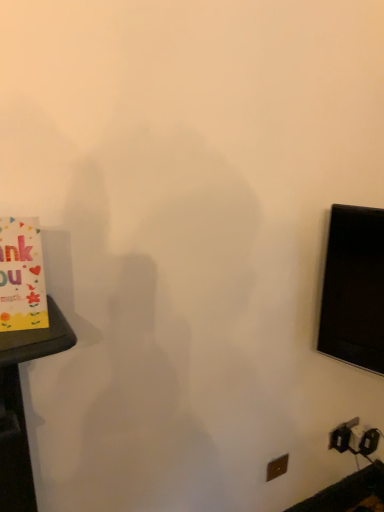
At what (x,y) coordinates should I click in order to perform the action: click on brown plastic electric outlet at lower right. Please return your answer as a coordinate pair (x, y). The height and width of the screenshot is (512, 384). Looking at the image, I should click on (277, 467).

This screenshot has height=512, width=384. Describe the element at coordinates (277, 467) in the screenshot. I see `brown plastic electric outlet at lower right` at that location.

In order to face yellow paper card at left, should I rotate leftwards or rightwards?

To align with it, rotate left about 23.982°.

Describe the element at coordinates (21, 276) in the screenshot. This screenshot has height=512, width=384. I see `yellow paper card at left` at that location.

What is the approximate height of yellow paper card at left?

7.48 inches.

The width and height of the screenshot is (384, 512). In order to click on yellow paper card at left in this screenshot , I will do `click(21, 276)`.

You are a GUI agent. You are given a task and a screenshot of the screen. Output one action in this format:
    pyautogui.click(x=<x>, y=<y>)
    Task: Click on the brown plastic electric outlet at lower right
    The image size is (384, 512).
    Given the screenshot: What is the action you would take?
    pyautogui.click(x=277, y=467)

Does brown plastic electric outlet at lower right appear on the right side of yellow paper card at left?

Yes, brown plastic electric outlet at lower right is to the right of yellow paper card at left.

Is brown plastic electric outlet at lower right positioned in front of yellow paper card at left?

No, brown plastic electric outlet at lower right is further to the viewer.

Which point is more forward, (273, 460) or (32, 316)?

The point (32, 316) is closer.

Looking at this image, from the image's perspective, is brown plastic electric outlet at lower right beneath yellow paper card at left?

Correct, brown plastic electric outlet at lower right appears lower than yellow paper card at left in the image.

From a real-world perspective, who is located higher, brown plastic electric outlet at lower right or yellow paper card at left?

yellow paper card at left is physically above.

Consider the image. Is brown plastic electric outlet at lower right wider or thinner than yellow paper card at left?

Clearly, brown plastic electric outlet at lower right has less width compared to yellow paper card at left.

Based on the photo, can you confirm if brown plastic electric outlet at lower right is shorter than yellow paper card at left?

Yes.

Considering the sizes of objects brown plastic electric outlet at lower right and yellow paper card at left in the image provided, who is bigger, brown plastic electric outlet at lower right or yellow paper card at left?

With larger size is yellow paper card at left.

Does brown plastic electric outlet at lower right contain yellow paper card at left?

No, yellow paper card at left is not surrounded by brown plastic electric outlet at lower right.

Is there a large distance between brown plastic electric outlet at lower right and yellow paper card at left?

Yes, brown plastic electric outlet at lower right and yellow paper card at left are located far from each other.

Is brown plastic electric outlet at lower right facing towards yellow paper card at left?

No.

How many degrees apart are the facing directions of brown plastic electric outlet at lower right and yellow paper card at left?

16.7 degrees separate the facing orientations of brown plastic electric outlet at lower right and yellow paper card at left.

Locate an element on the screen. Image resolution: width=384 pixels, height=512 pixels. electric outlet on the right of yellow paper card at left is located at coordinates (277, 467).

Is yellow paper card at left at the left side of brown plastic electric outlet at lower right?

Yes, yellow paper card at left is to the left of brown plastic electric outlet at lower right.

Considering the positions of objects yellow paper card at left and brown plastic electric outlet at lower right in the image provided, who is behind, yellow paper card at left or brown plastic electric outlet at lower right?

brown plastic electric outlet at lower right is more distant.

Is point (24, 293) positioned after point (273, 479)?

No, (24, 293) is in front of (273, 479).

From the image's perspective, which object appears higher, yellow paper card at left or brown plastic electric outlet at lower right?

yellow paper card at left is shown above in the image.

From a real-world perspective, who is located lower, yellow paper card at left or brown plastic electric outlet at lower right?

brown plastic electric outlet at lower right.

In terms of width, does yellow paper card at left look wider or thinner when compared to brown plastic electric outlet at lower right?

Clearly, yellow paper card at left has more width compared to brown plastic electric outlet at lower right.

Considering the sizes of yellow paper card at left and brown plastic electric outlet at lower right in the image, is yellow paper card at left taller or shorter than brown plastic electric outlet at lower right?

yellow paper card at left is taller than brown plastic electric outlet at lower right.

Which of these two, yellow paper card at left or brown plastic electric outlet at lower right, is bigger?

yellow paper card at left is bigger.

Would you say yellow paper card at left is outside brown plastic electric outlet at lower right?

yellow paper card at left is positioned outside brown plastic electric outlet at lower right.

From the picture: Can you see yellow paper card at left touching brown plastic electric outlet at lower right?

There is a gap between yellow paper card at left and brown plastic electric outlet at lower right.

Is yellow paper card at left oriented towards brown plastic electric outlet at lower right?

No.

How much distance is there between yellow paper card at left and brown plastic electric outlet at lower right?

A distance of 1.08 meters exists between yellow paper card at left and brown plastic electric outlet at lower right.

In the image, there is a yellow paper card at left. Find the location of `electric outlet below it (from a real-world perspective)`. electric outlet below it (from a real-world perspective) is located at coordinates (277, 467).

Where is `electric outlet located on the right of yellow paper card at left`? This screenshot has height=512, width=384. electric outlet located on the right of yellow paper card at left is located at coordinates click(x=277, y=467).

Image resolution: width=384 pixels, height=512 pixels. I want to click on birthday card that is above the brown plastic electric outlet at lower right (from the image's perspective), so click(x=21, y=276).